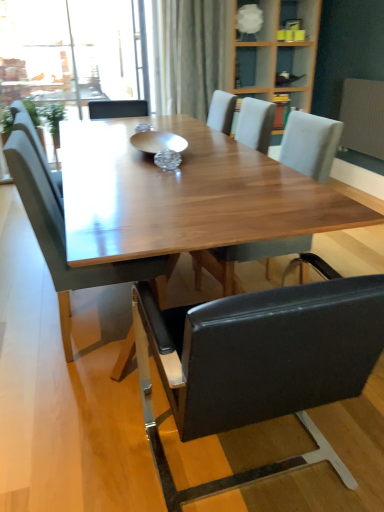
Question: From a real-world perspective, is white textured radiator at right physically above light gray fabric chair at center, which is the first chair from right to left?

Choices:
 (A) yes
 (B) no

Answer: (B)

Question: Could light gray fabric chair at center, which is the first chair from right to left, be considered to be inside white textured radiator at right?

Choices:
 (A) no
 (B) yes

Answer: (A)

Question: Is white textured radiator at right facing away from light gray fabric chair at center, the third chair positioned from the left?

Choices:
 (A) no
 (B) yes

Answer: (A)

Question: Is white textured radiator at right touching light gray fabric chair at center, the third chair positioned from the left?

Choices:
 (A) no
 (B) yes

Answer: (A)

Question: Considering the relative positions of white textured radiator at right and light gray fabric chair at center, which is the first chair from right to left, in the image provided, is white textured radiator at right in front of light gray fabric chair at center, which is the first chair from right to left,?

Choices:
 (A) no
 (B) yes

Answer: (A)

Question: Is leather-like black chair at center, the second chair in the left-to-right sequence, taller or shorter than light gray fabric chair at center, the third chair positioned from the left?

Choices:
 (A) short
 (B) tall

Answer: (B)

Question: Considering the positions of leather-like black chair at center, the 2th chair from the right, and light gray fabric chair at center, the third chair positioned from the left, in the image, is leather-like black chair at center, the 2th chair from the right, wider or thinner than light gray fabric chair at center, the third chair positioned from the left,?

Choices:
 (A) wide
 (B) thin

Answer: (A)

Question: From the image's perspective, is leather-like black chair at center, the 2th chair from the right, above or below light gray fabric chair at center, which is the first chair from right to left?

Choices:
 (A) below
 (B) above

Answer: (A)

Question: Relative to light gray fabric chair at center, which is the first chair from right to left, is leather-like black chair at center, the second chair in the left-to-right sequence, in front or behind?

Choices:
 (A) front
 (B) behind

Answer: (A)

Question: In the image, is white frosted glass lampshade at upper center positioned in front of or behind matte gray chair at left, which appears as the 3th chair when viewed from the right?

Choices:
 (A) behind
 (B) front

Answer: (A)

Question: Considering the positions of white frosted glass lampshade at upper center and matte gray chair at left, which is the 1th chair in left-to-right order, in the image, is white frosted glass lampshade at upper center taller or shorter than matte gray chair at left, which is the 1th chair in left-to-right order,?

Choices:
 (A) tall
 (B) short

Answer: (B)

Question: Is white frosted glass lampshade at upper center to the left or to the right of matte gray chair at left, which appears as the 3th chair when viewed from the right, in the image?

Choices:
 (A) right
 (B) left

Answer: (A)

Question: From a real-world perspective, is white frosted glass lampshade at upper center positioned above or below matte gray chair at left, which is the 1th chair in left-to-right order?

Choices:
 (A) above
 (B) below

Answer: (A)

Question: Is leather-like black chair at center, the 2th chair from the right, inside or outside of matte gray chair at left, which appears as the 3th chair when viewed from the right?

Choices:
 (A) inside
 (B) outside

Answer: (B)

Question: In the image, is leather-like black chair at center, the second chair in the left-to-right sequence, on the left side or the right side of matte gray chair at left, which appears as the 3th chair when viewed from the right?

Choices:
 (A) right
 (B) left

Answer: (A)